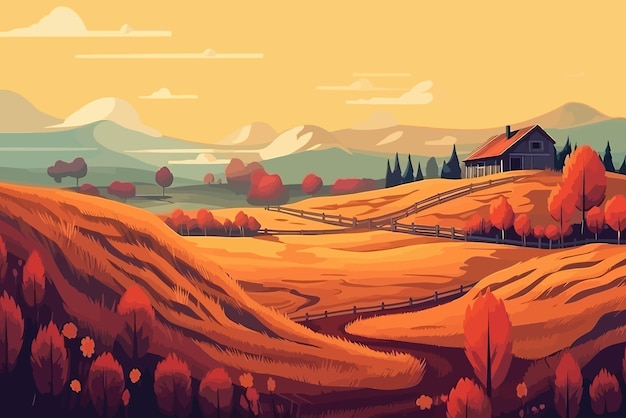
Find the location of `window`. window is located at coordinates (536, 142).